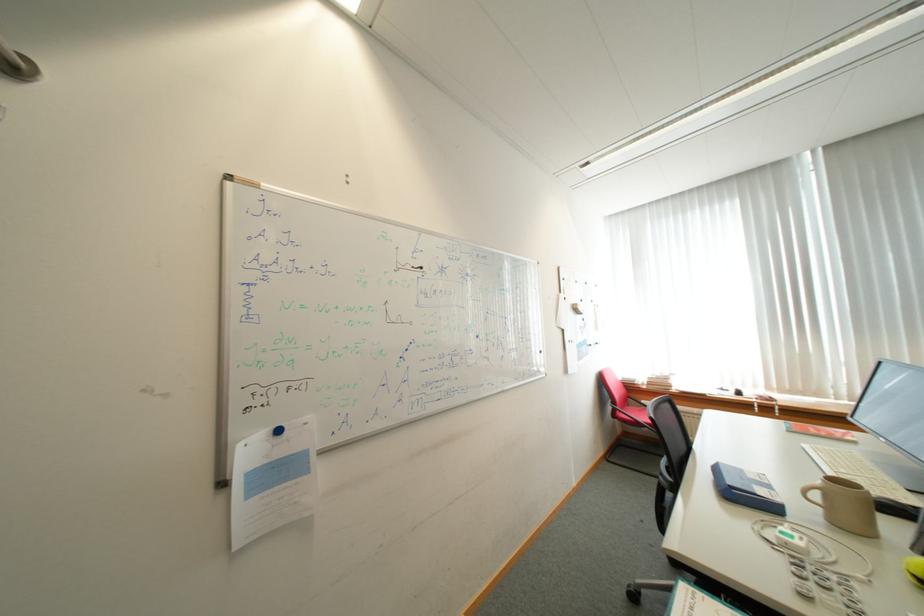
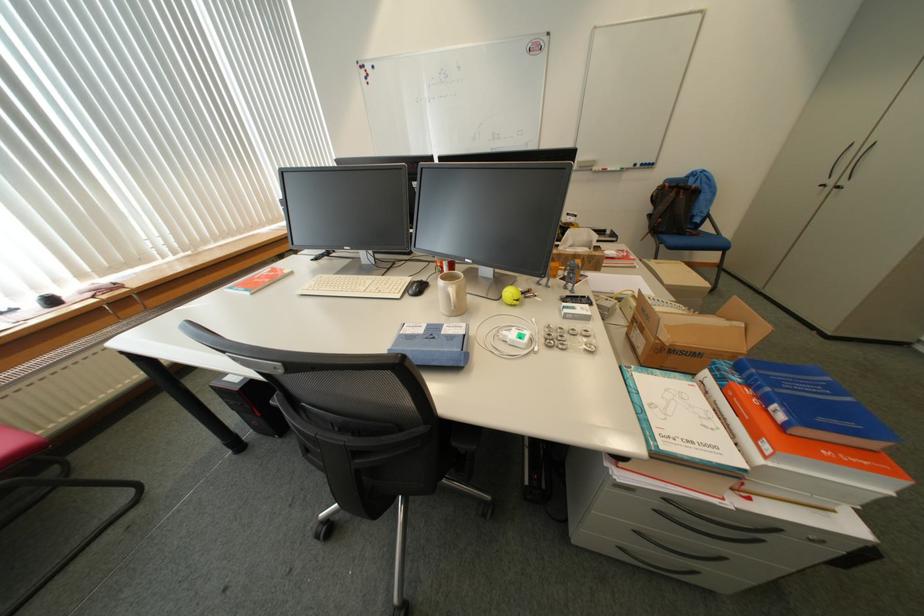
The point at (760,477) is marked in the first image. Where is the corresponding point in the second image?

(430, 331)